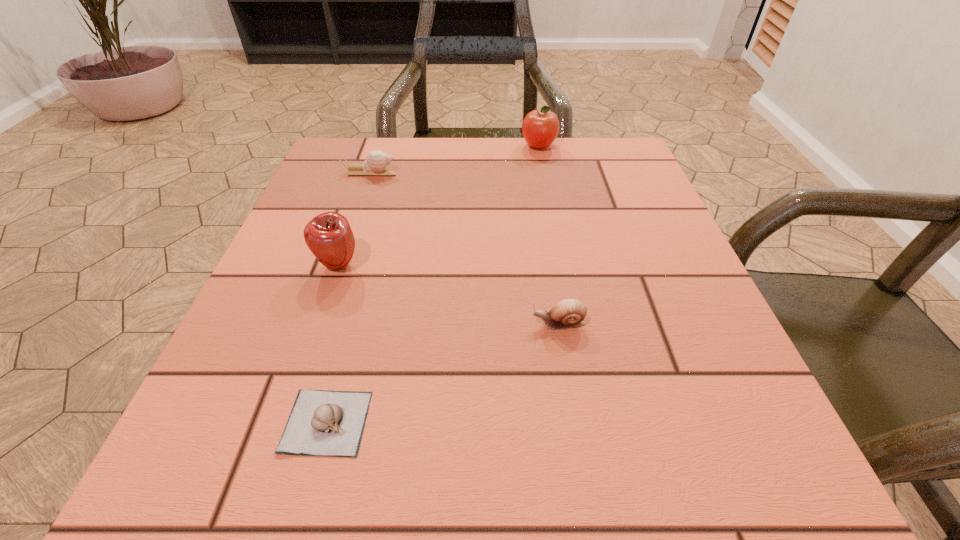
Where is `vacant region at the near left corner of the desktop`? The height and width of the screenshot is (540, 960). vacant region at the near left corner of the desktop is located at coordinates (208, 470).

Locate an element on the screen. The height and width of the screenshot is (540, 960). free spot at the far right corner of the desktop is located at coordinates (593, 142).

Where is `vacant area that lies between the farthest object and the shortest object`? The image size is (960, 540). vacant area that lies between the farthest object and the shortest object is located at coordinates (433, 284).

This screenshot has width=960, height=540. I want to click on free space between the second farthest object and the garlic, so click(x=348, y=297).

The height and width of the screenshot is (540, 960). Find the location of `vacant point located between the farther apple and the nearer apple`. vacant point located between the farther apple and the nearer apple is located at coordinates click(439, 205).

Find the location of a particular element. vacant space in between the farthest object and the shortest object is located at coordinates (433, 284).

What are the coordinates of `vacant region between the garlic and the second farthest object` in the screenshot? It's located at (348, 297).

Where is `vacant area that lies between the nearer escargot and the right apple`? vacant area that lies between the nearer escargot and the right apple is located at coordinates (549, 235).

Where is `vacant area between the farther apple and the garlic`? vacant area between the farther apple and the garlic is located at coordinates (433, 284).

This screenshot has height=540, width=960. What are the coordinates of `empty space that is in between the farther apple and the farther escargot` in the screenshot? It's located at (454, 159).